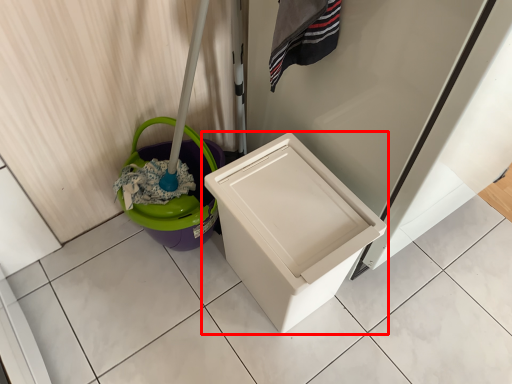
Question: From the image's perspective, where is waste container (annotated by the red box) located in relation to potty in the image?

Choices:
 (A) below
 (B) above

Answer: (A)